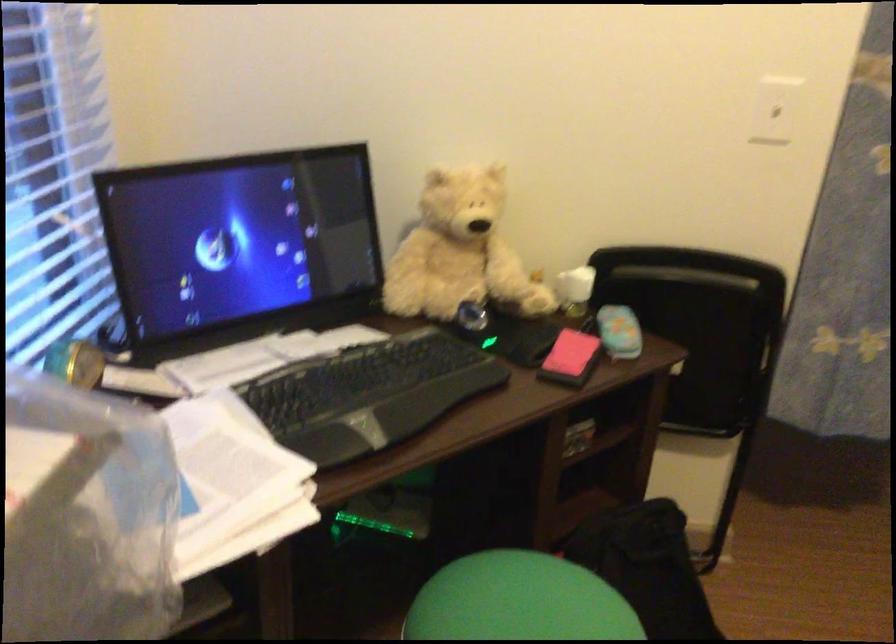
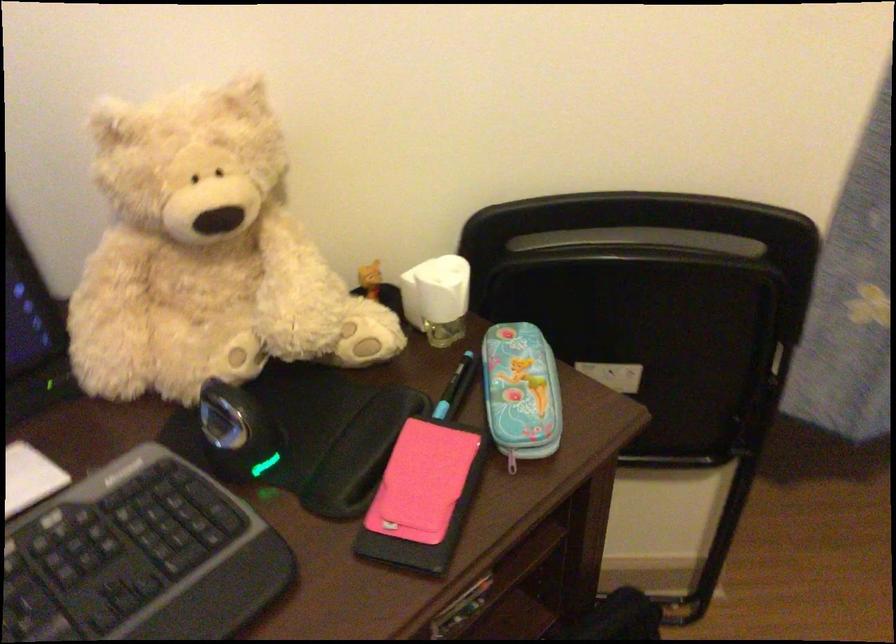
Find the pixel in the second image that matches (x=693, y=272) in the first image.

(642, 240)